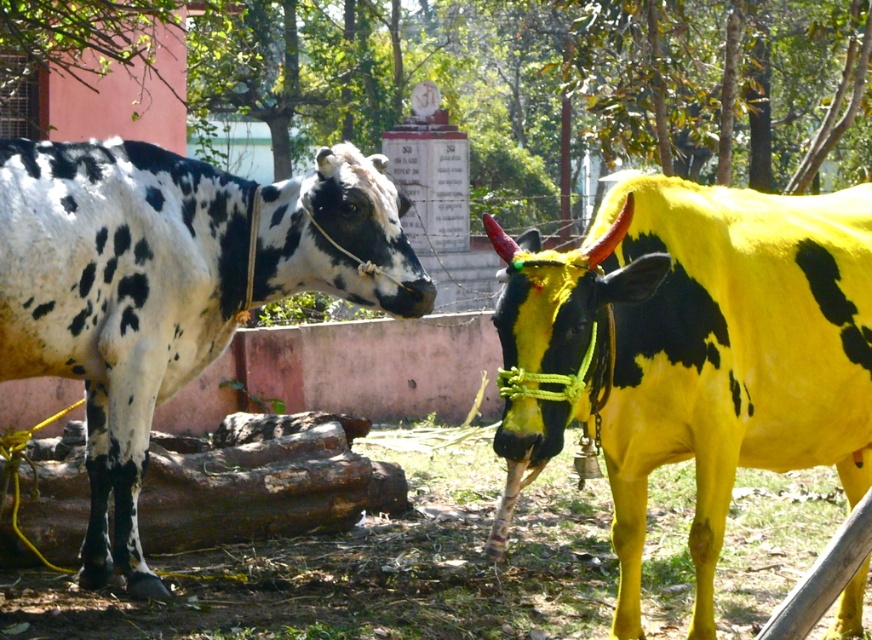
Does yellow painted bull at right appear on the right side of white-spotted cow at left?

Correct, you'll find yellow painted bull at right to the right of white-spotted cow at left.

Does yellow painted bull at right appear over white-spotted cow at left?

Incorrect, yellow painted bull at right is not positioned above white-spotted cow at left.

Is point (802, 243) more distant than point (346, 141)?

No, (802, 243) is closer to viewer.

The height and width of the screenshot is (640, 872). Find the location of `yellow painted bull at right`. yellow painted bull at right is located at coordinates (689, 353).